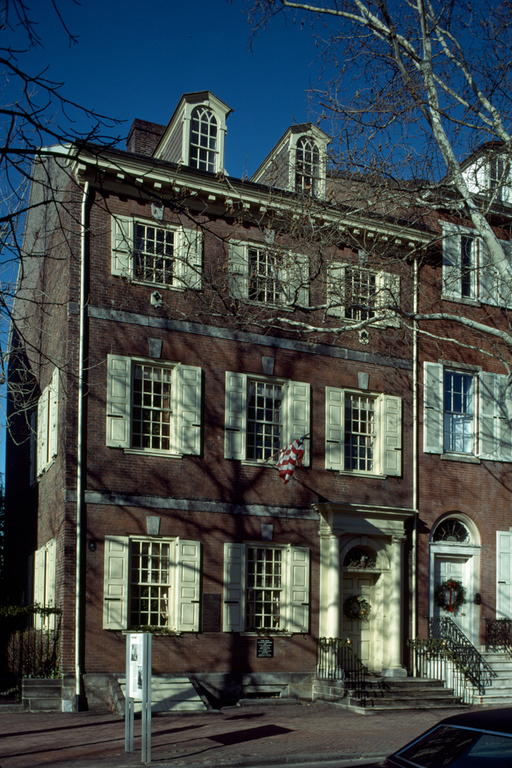
Identify the location of columns. (334, 576), (397, 584).